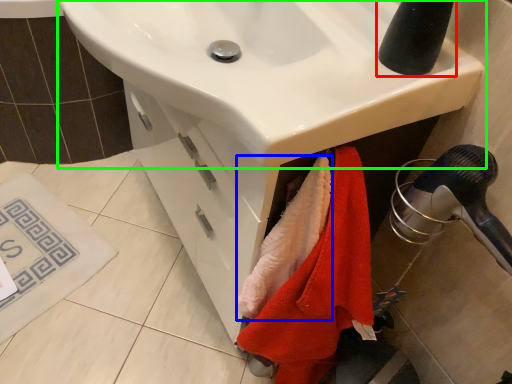
Question: Estimate the real-world distances between objects in this image. Which object is closer to tap (highlighted by a red box), beach towel (highlighted by a blue box) or sink (highlighted by a green box)?

Choices:
 (A) beach towel
 (B) sink

Answer: (B)